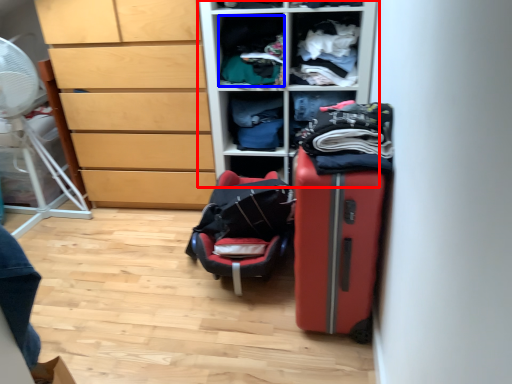
Question: Which point is further to the camera, furniture (highlighted by a red box) or clothing (highlighted by a blue box)?

Choices:
 (A) furniture
 (B) clothing

Answer: (B)